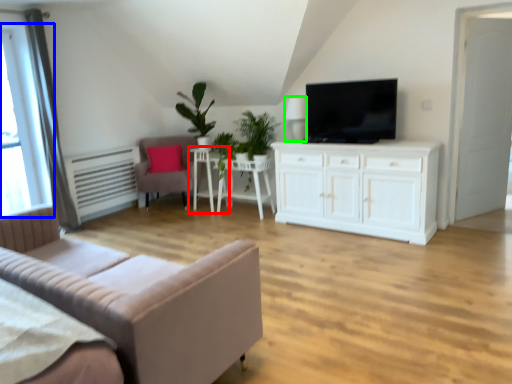
Question: Which object is positioned closest to side table (highlighted by a red box)? Select from window (highlighted by a blue box) and lamp (highlighted by a green box).

Choices:
 (A) window
 (B) lamp

Answer: (B)